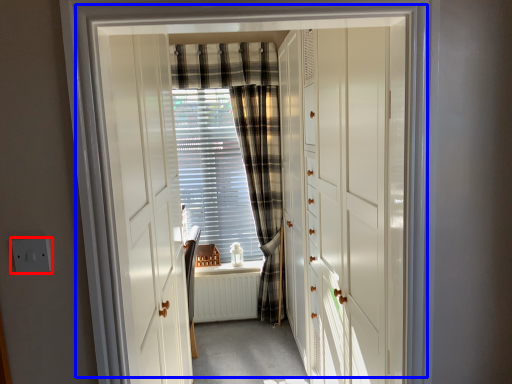
Question: Which point is closer to the camera, electric outlet (highlighted by a red box) or door (highlighted by a blue box)?

Choices:
 (A) electric outlet
 (B) door

Answer: (B)